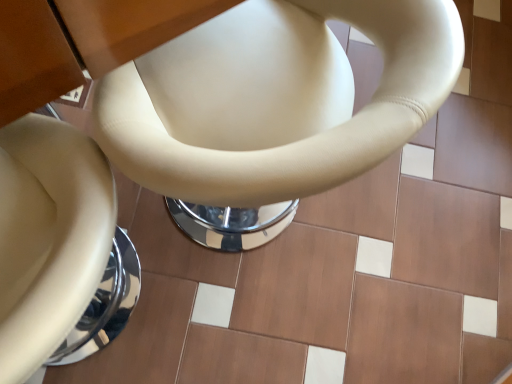
This screenshot has height=384, width=512. What are the coordinates of `beige leather toilet at center` in the screenshot? It's located at (275, 99).

What do you see at coordinates (275, 99) in the screenshot? I see `beige leather toilet at center` at bounding box center [275, 99].

Locate an element on the screen. This screenshot has height=384, width=512. beige leather toilet at center is located at coordinates (275, 99).